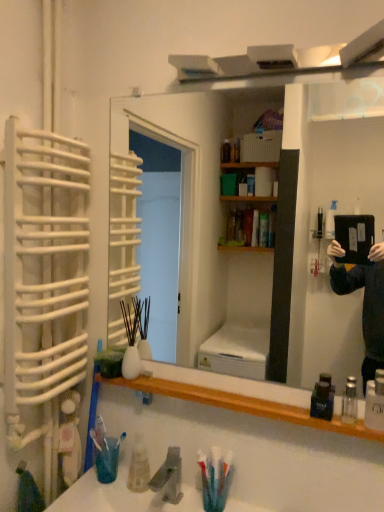
Question: Would you say white plastic toothbrush at left, positioned as the 2th toothbrush in right-to-left order, is outside translucent plastic toothbrush at lower left, placed as the 2th toothbrush when sorted from left to right?

Choices:
 (A) yes
 (B) no

Answer: (A)

Question: Can you see white plastic toothbrush at left, positioned as the 2th toothbrush in right-to-left order, touching translucent plastic toothbrush at lower left, which is counted as the first toothbrush, starting from the right?

Choices:
 (A) no
 (B) yes

Answer: (B)

Question: Is white plastic toothbrush at left, the first toothbrush positioned from the left, wider than translucent plastic toothbrush at lower left, which is counted as the first toothbrush, starting from the right?

Choices:
 (A) yes
 (B) no

Answer: (A)

Question: Would you say translucent plastic toothbrush at lower left, placed as the 2th toothbrush when sorted from left to right, is part of white plastic toothbrush at left, the first toothbrush positioned from the left,'s contents?

Choices:
 (A) no
 (B) yes

Answer: (A)

Question: Does white plastic toothbrush at left, the first toothbrush positioned from the left, appear on the right side of translucent plastic toothbrush at lower left, which is counted as the first toothbrush, starting from the right?

Choices:
 (A) yes
 (B) no

Answer: (B)

Question: Considering the positions of point (345, 412) and point (309, 415), is point (345, 412) closer or farther from the camera than point (309, 415)?

Choices:
 (A) farther
 (B) closer

Answer: (A)

Question: From the image's perspective, is clear glass bottle at lower right, placed as the first mouthwash when sorted from right to left, located above or below dark blue plastic mouthwash at lower right, the 2th mouthwash in the right-to-left sequence?

Choices:
 (A) above
 (B) below

Answer: (B)

Question: From a real-world perspective, is clear glass bottle at lower right, positioned as the second mouthwash in left-to-right order, positioned above or below dark blue plastic mouthwash at lower right, the 2th mouthwash in the right-to-left sequence?

Choices:
 (A) above
 (B) below

Answer: (B)

Question: Is clear glass bottle at lower right, positioned as the second mouthwash in left-to-right order, spatially inside dark blue plastic mouthwash at lower right, the 2th mouthwash in the right-to-left sequence, or outside of it?

Choices:
 (A) inside
 (B) outside

Answer: (B)

Question: Is point (178, 463) closer or farther from the camera than point (276, 394)?

Choices:
 (A) farther
 (B) closer

Answer: (A)

Question: In the image, is gray matte faucet at lower center positioned in front of or behind wooden shelf at lower center?

Choices:
 (A) front
 (B) behind

Answer: (B)

Question: Based on their positions, is gray matte faucet at lower center located to the left or right of wooden shelf at lower center?

Choices:
 (A) left
 (B) right

Answer: (A)

Question: Considering the positions of gray matte faucet at lower center and wooden shelf at lower center in the image, is gray matte faucet at lower center wider or thinner than wooden shelf at lower center?

Choices:
 (A) thin
 (B) wide

Answer: (B)

Question: In the image, is gray matte faucet at lower center positioned in front of or behind dark blue plastic mouthwash at lower right, which ranks as the first mouthwash in left-to-right order?

Choices:
 (A) behind
 (B) front

Answer: (A)

Question: Is gray matte faucet at lower center wider or thinner than dark blue plastic mouthwash at lower right, the 2th mouthwash in the right-to-left sequence?

Choices:
 (A) thin
 (B) wide

Answer: (B)